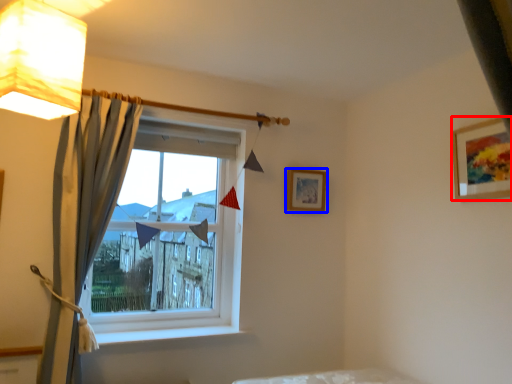
Question: Which object is closer to the camera taking this photo, picture frame (highlighted by a red box) or picture frame (highlighted by a blue box)?

Choices:
 (A) picture frame
 (B) picture frame

Answer: (A)